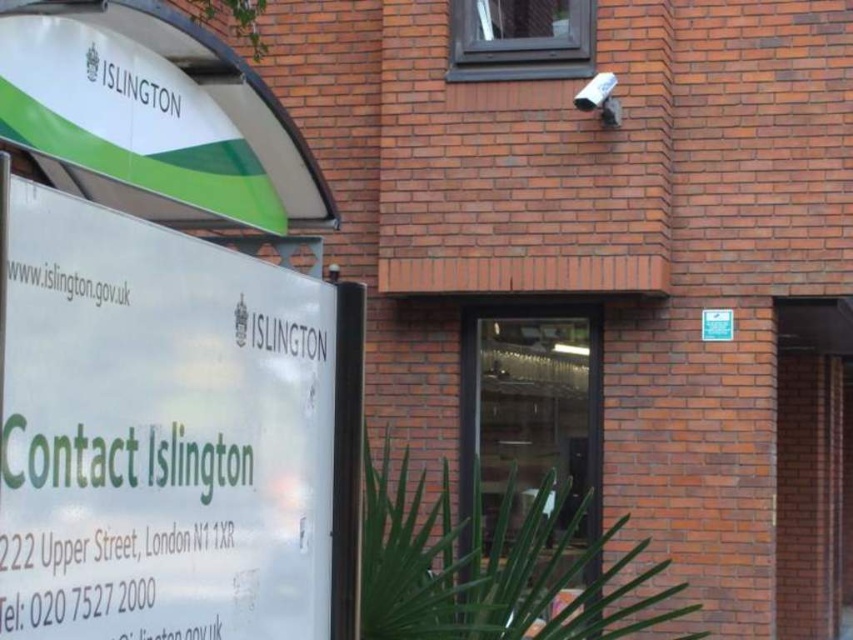
You are standing in front of the building and need to enter through the transparent glass door at center. There is a white paper sign at left blocking your path. Can you walk around it to reach the door?

The white paper sign at left is closer to the viewer than the transparent glass door at center, so you can walk around it to reach the transparent glass door at center since it is behind the sign.